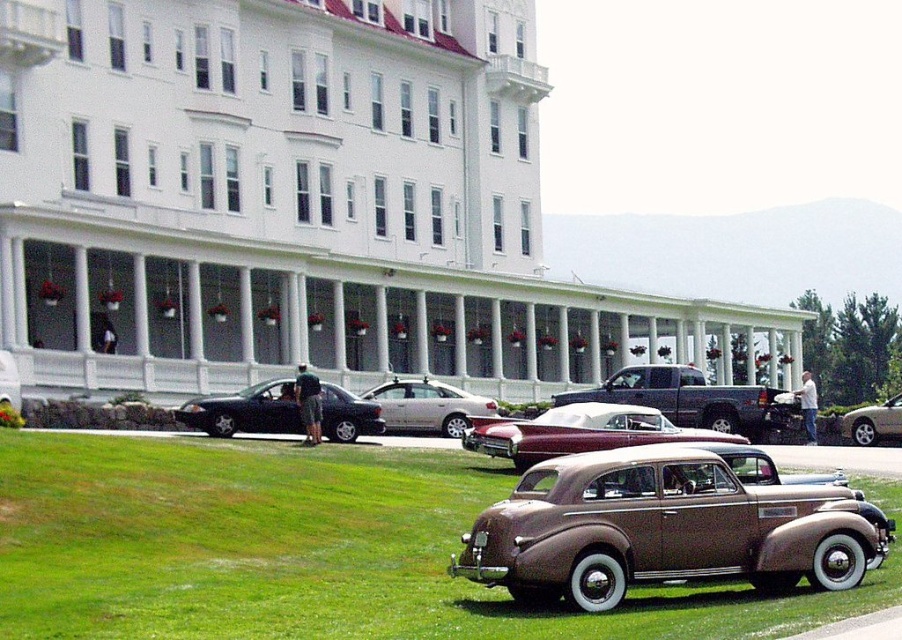
Question: Which point is farther to the camera?

Choices:
 (A) shiny gold sedan at center
 (B) shiny black sedan at center

Answer: (B)

Question: Which of the following is the farthest from the observer?

Choices:
 (A) shiny silver sedan at center
 (B) silver metallic sedan at center

Answer: (A)

Question: Can you confirm if shiny gold sedan at center is positioned to the left of shiny silver sedan at center?

Choices:
 (A) yes
 (B) no

Answer: (A)

Question: Is shiny silver sedan at center below silver metallic sedan at center?

Choices:
 (A) no
 (B) yes

Answer: (A)

Question: Can you confirm if maroon leather convertible at center is bigger than silver metallic sedan at center?

Choices:
 (A) yes
 (B) no

Answer: (A)

Question: Which point is farther from the camera taking this photo?

Choices:
 (A) (687, 396)
 (B) (843, 436)
 (C) (214, 420)

Answer: (B)